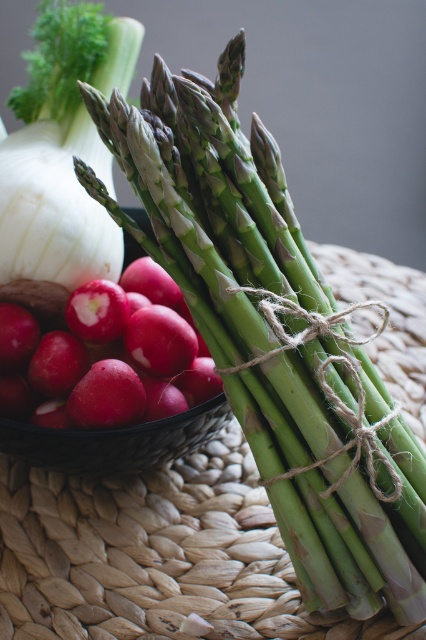
Looking at this image, you are arranging vegetables on a table and see the smooth red radish at lower left and the white smooth onion at upper left. Which vegetable is located to the right of the other?

The smooth red radish at lower left is positioned on the right side of white smooth onion at upper left.

You are looking at the vegetables arranged on the woven surface. There are two points marked in the image. Which point is closer to you, point (71,388) or point (23,179)?

Point (71,388) is closer to the viewer than point (23,179).

You are preparing a salad and need to choose between the smooth red radish at lower left and the white smooth onion at upper left. Which one is bigger?

The smooth red radish at lower left has a larger size compared to the white smooth onion at upper left, so the smooth red radish at lower left is bigger.